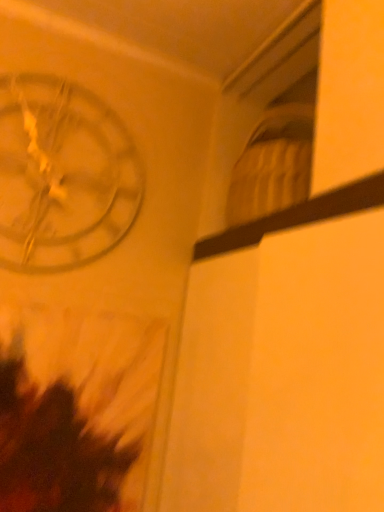
Measure the distance between point (70, 260) and camera.

Point (70, 260) is 1.05 meters away from camera.

Describe the element at coordinates (62, 175) in the screenshot. I see `metallic gold clock at upper left` at that location.

Image resolution: width=384 pixels, height=512 pixels. I want to click on metallic gold clock at upper left, so click(62, 175).

Find the location of a particular element. Image resolution: width=384 pixels, height=512 pixels. metallic gold clock at upper left is located at coordinates (62, 175).